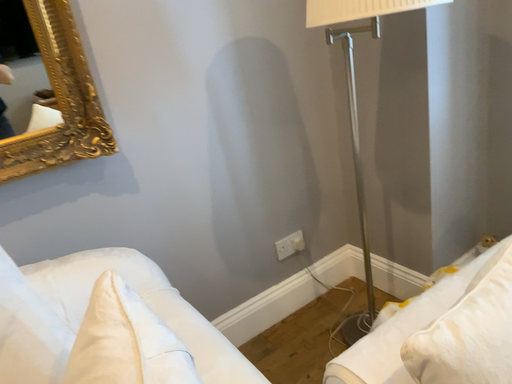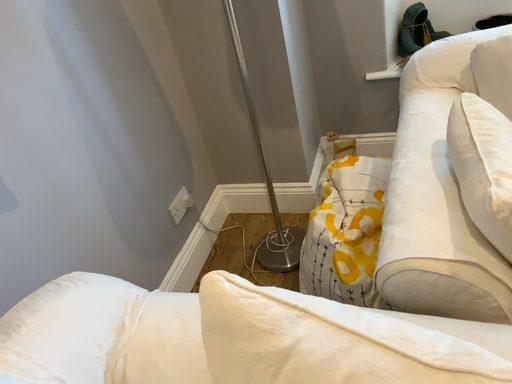
Question: Which way did the camera rotate in the video?

Choices:
 (A) rotated right
 (B) rotated left

Answer: (A)